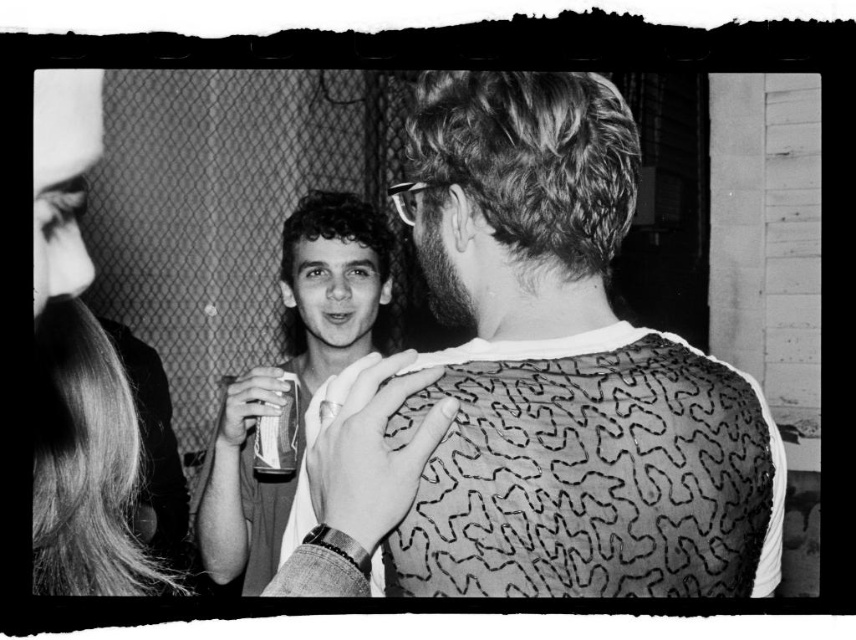
Question: Which point is closer to the camera taking this photo?

Choices:
 (A) (55, 561)
 (B) (224, 573)

Answer: (A)

Question: Can you confirm if smooth hair at left is wider than smooth white shirt at center?

Choices:
 (A) no
 (B) yes

Answer: (B)

Question: Among these points, which one is nearest to the camera?

Choices:
 (A) (324, 340)
 (B) (90, 394)

Answer: (B)

Question: Can you confirm if patterned fabric shirt at center is positioned above smooth hair at left?

Choices:
 (A) yes
 (B) no

Answer: (B)

Question: Can you confirm if patterned fabric shirt at center is positioned to the left of smooth hair at left?

Choices:
 (A) no
 (B) yes

Answer: (A)

Question: Which point is closer to the camera taking this photo?

Choices:
 (A) coord(483,573)
 (B) coord(331,196)
 (C) coord(86,522)

Answer: (A)